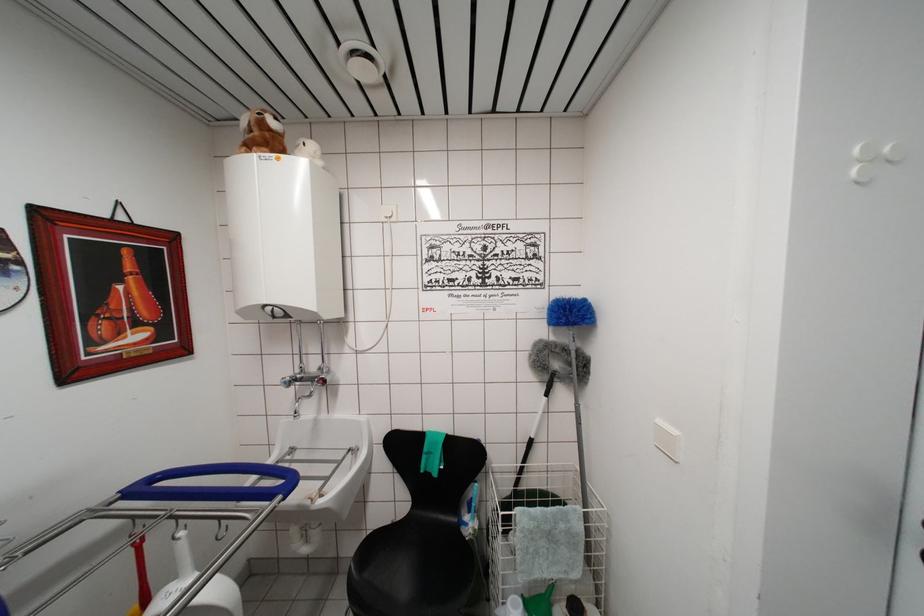
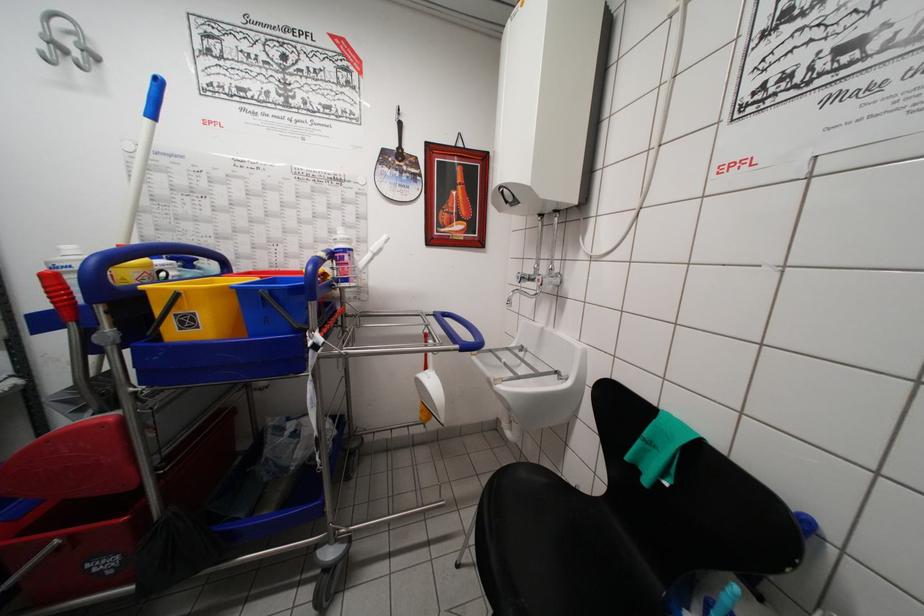
The point at (283, 503) is marked in the first image. Where is the corresponding point in the second image?

(460, 351)